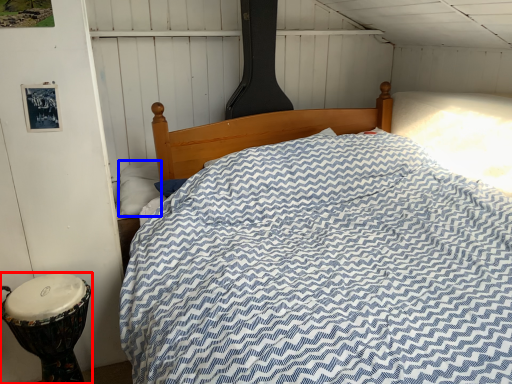
Question: Which object appears farthest to the camera in this image, drum (highlighted by a red box) or pillow (highlighted by a blue box)?

Choices:
 (A) drum
 (B) pillow

Answer: (B)